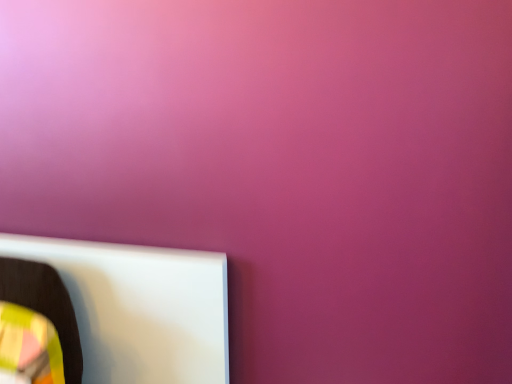
The image size is (512, 384). Describe the element at coordinates (45, 305) in the screenshot. I see `matte plastic swivel chair at lower left` at that location.

The image size is (512, 384). Identify the location of matte plastic swivel chair at lower left. (45, 305).

Locate an element on the screen. The width and height of the screenshot is (512, 384). matte plastic swivel chair at lower left is located at coordinates (45, 305).